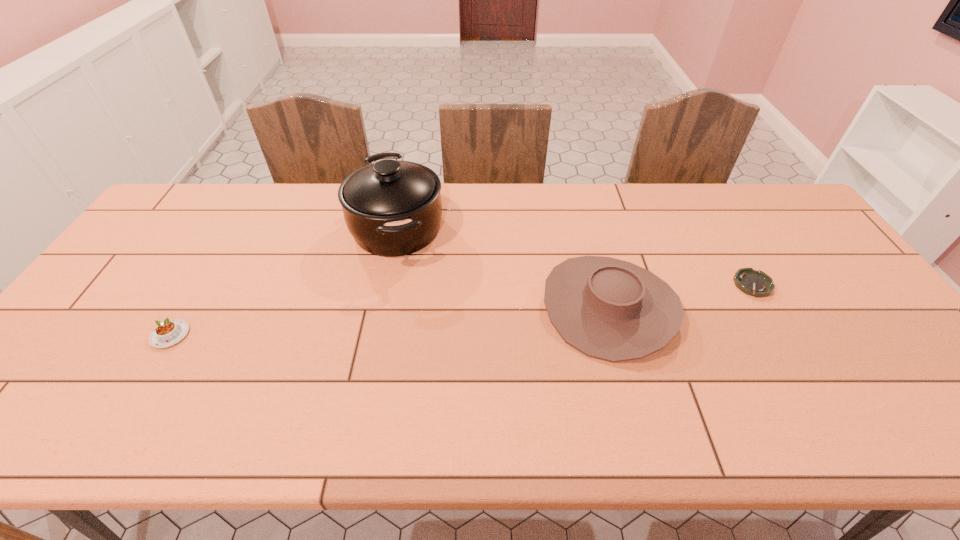
Locate an element on the screen. The image size is (960, 540). free space that is in between the second shortest object and the second object from left to right is located at coordinates (284, 281).

You are a GUI agent. You are given a task and a screenshot of the screen. Output one action in this format:
    pyautogui.click(x=<x>, y=<y>)
    Task: Click on the free spot between the second shortest object and the third object from right to left
    The image size is (960, 540).
    Given the screenshot: What is the action you would take?
    pyautogui.click(x=284, y=281)

Identify the location of empty space between the pudding and the saucepan. This screenshot has height=540, width=960. (284, 281).

This screenshot has width=960, height=540. What are the coordinates of `unoccupied area between the second tallest object and the rightmost object` in the screenshot? It's located at (681, 296).

What are the coordinates of `free spot between the second object from right to left and the ashtray` in the screenshot? It's located at (681, 296).

Identify the location of free space between the second shortest object and the rightmost object. (462, 309).

At what (x,y) coordinates should I click in order to perform the action: click on unoccupied position between the shortest object and the second shortest object. Please return your answer as a coordinate pair (x, y). Looking at the image, I should click on (462, 309).

The image size is (960, 540). I want to click on object identified as the third closest to the tallest object, so click(x=755, y=283).

Identify which object is the closest to the shortest object. Please provide its 2D coordinates. Your answer should be formatted as a tuple, i.e. [(x, y)], where the tuple contains the x and y coordinates of a point satisfying the conditions above.

[(609, 309)]

Locate an element on the screen. This screenshot has height=540, width=960. free space that satisfies the following two spatial constraints: 1. on the front side of the second object from left to right; 2. on the left side of the ashtray is located at coordinates (386, 285).